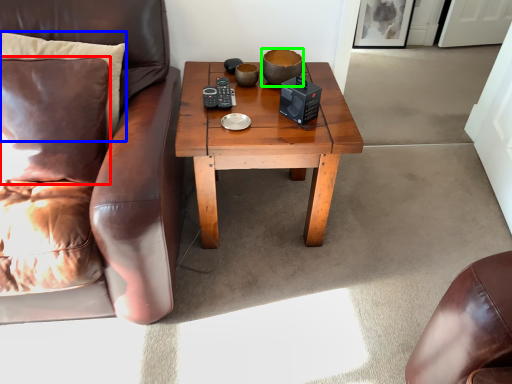
Question: Which object is the farthest from pillow (highlighted by a red box)? Choose among these: pillow (highlighted by a blue box) or bowl (highlighted by a green box).

Choices:
 (A) pillow
 (B) bowl

Answer: (B)